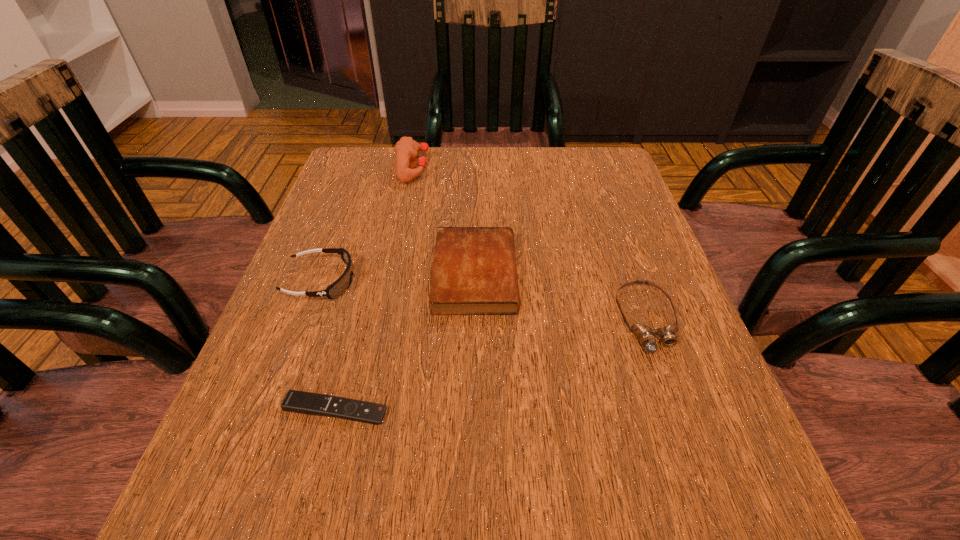
What are the coordinates of `free space that satisfies the following two spatial constraints: 1. on the back side of the shortest object; 2. on the front and sides of the left goggles` in the screenshot? It's located at (369, 281).

This screenshot has width=960, height=540. In order to click on free space that satisfies the following two spatial constraints: 1. on the back side of the shortest object; 2. on the front and sides of the taller goggles in this screenshot , I will do `click(369, 281)`.